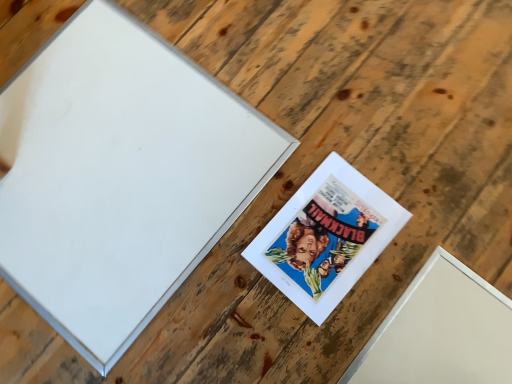
This screenshot has width=512, height=384. I want to click on vacant space behind matte paper picture frame at center, arranged as the first picture frame when viewed from the right, so click(300, 134).